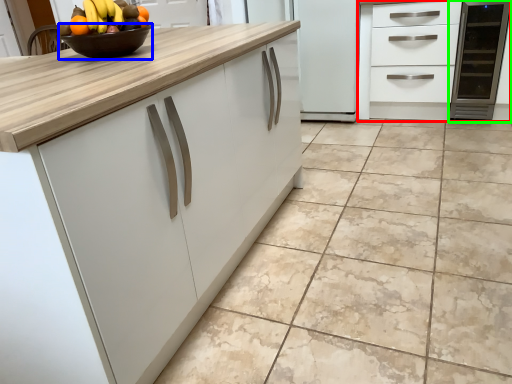
Question: Which object is the closest to the cabinetry (highlighted by a red box)? Choose among these: bowl (highlighted by a blue box) or appliance (highlighted by a green box).

Choices:
 (A) bowl
 (B) appliance

Answer: (B)